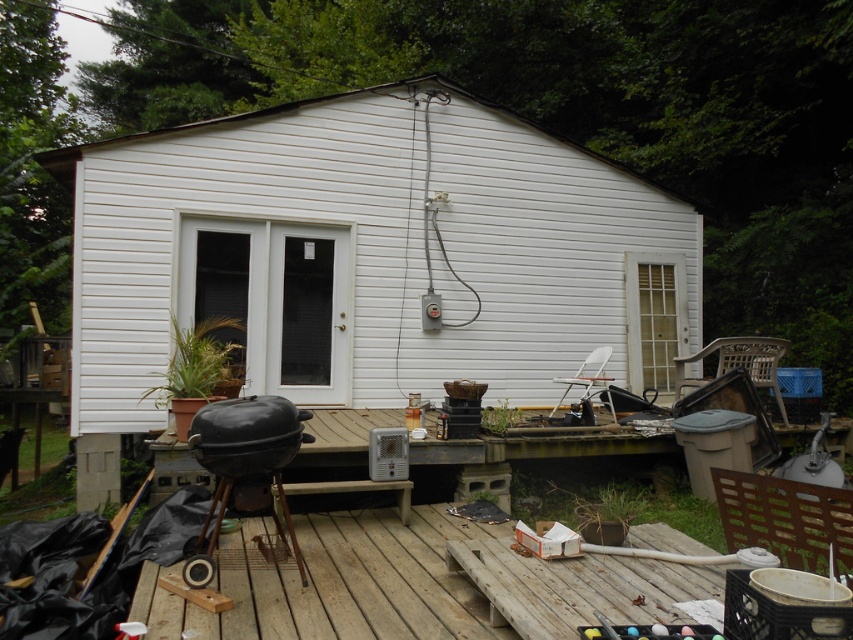
Question: Does white siding shed at center appear on the left side of black matte barbecue grill at lower left?

Choices:
 (A) no
 (B) yes

Answer: (A)

Question: Which object appears closest to the camera in this image?

Choices:
 (A) wooden bench at lower center
 (B) white siding shed at center
 (C) black matte barbecue grill at lower left

Answer: (A)

Question: Among these points, which one is farthest from the camera?

Choices:
 (A) (152, 403)
 (B) (268, 588)

Answer: (A)

Question: Observing the image, what is the correct spatial positioning of wooden bench at lower center in reference to black matte barbecue grill at lower left?

Choices:
 (A) above
 (B) below

Answer: (B)

Question: Which point appears closest to the camera in this image?

Choices:
 (A) [x=376, y=620]
 (B) [x=689, y=336]

Answer: (A)

Question: Is white siding shed at center wider than black matte barbecue grill at lower left?

Choices:
 (A) no
 (B) yes

Answer: (B)